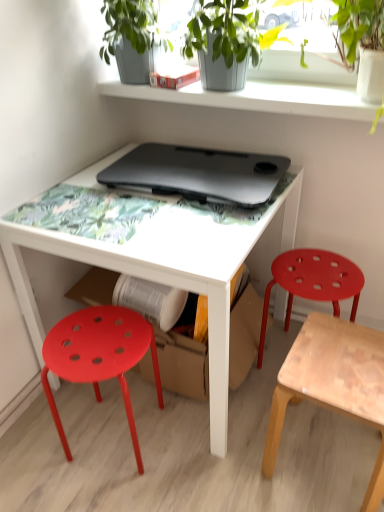
Identify the location of vacant area situated below matte plastic stool at lower left, which ranks as the 3th stool in right-to-left order (from a real-world perspective). (109, 440).